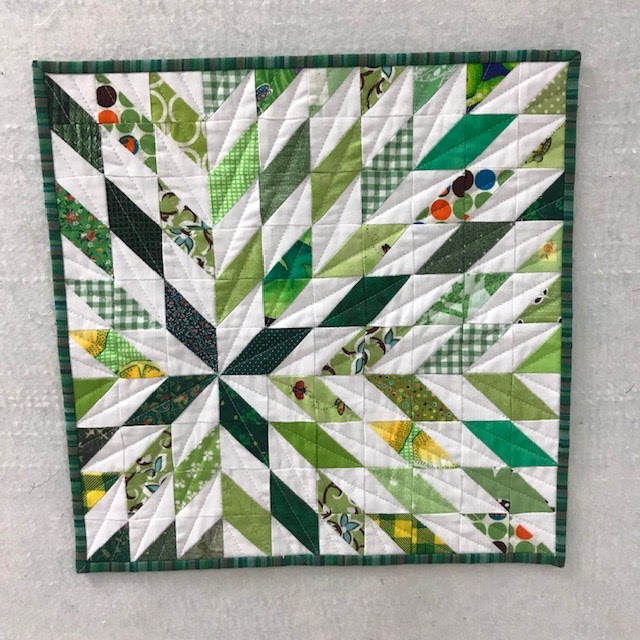
Locate an element on the screen. The height and width of the screenshot is (640, 640). lower left quilt corner is located at coordinates (76, 566).